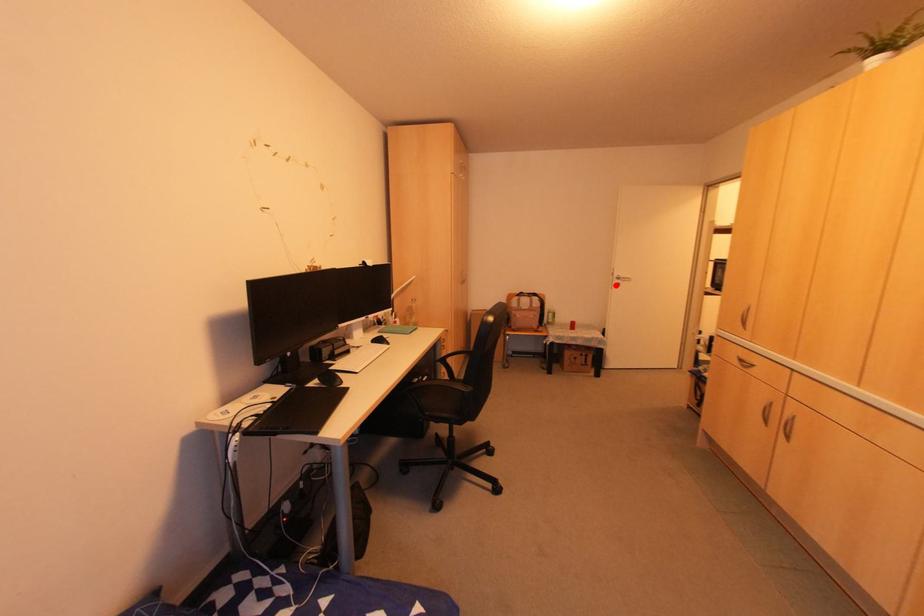
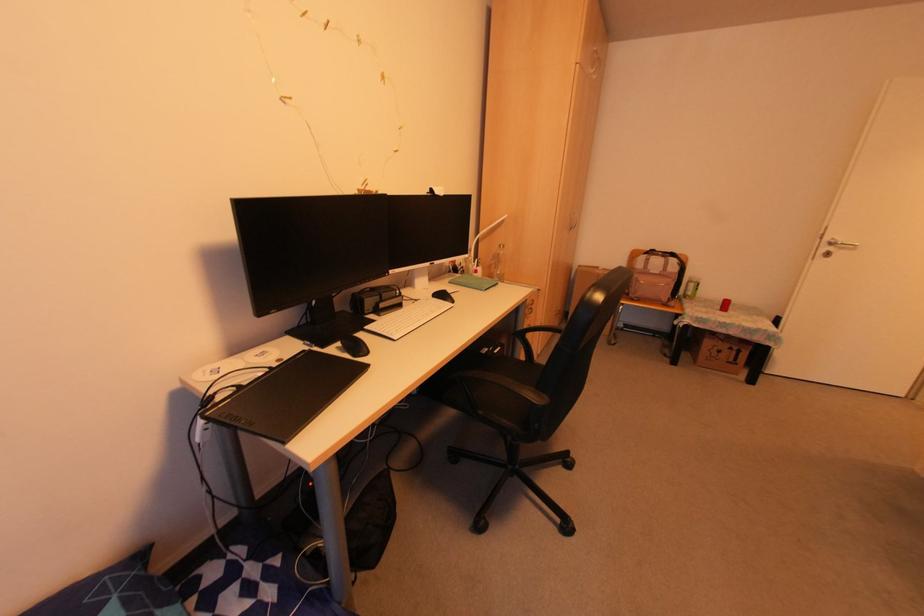
Locate, in the second image, the point that corresponds to the highlighted location in the first image.

(825, 254)